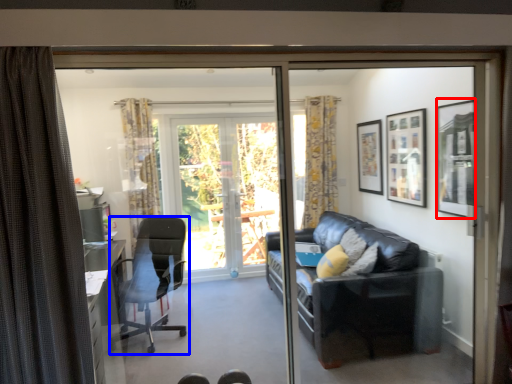
Question: Among these objects, which one is farthest to the camera, picture frame (highlighted by a red box) or chair (highlighted by a blue box)?

Choices:
 (A) picture frame
 (B) chair

Answer: (B)